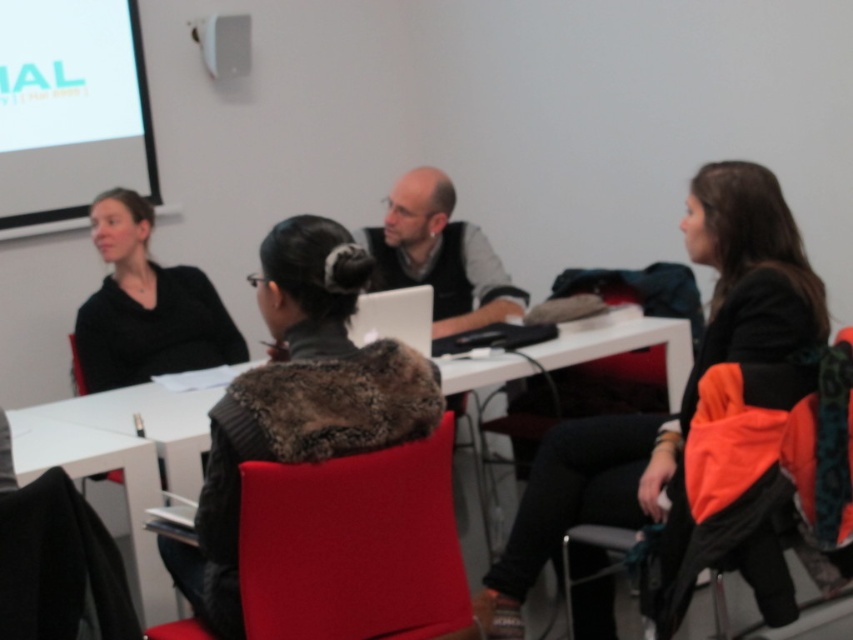
You are sitting in the black fabric chair at lower left and want to hand a document to the person sitting in the velvet red chair at center. Which direction should you move to reach them?

The velvet red chair at center is located above the black fabric chair at lower left, so you should move upwards to reach them.

You are a delivery robot with a package that measures 1.5 meters in length. You need to navigate through the space between the dark gray fur coat at center and the black matte jacket at left to reach the table. Can you fit through this space?

The distance between the dark gray fur coat at center and the black matte jacket at left is 1.36 meters. Since your package is 1.5 meters long, it is longer than the available space, so you cannot fit through this path.

You are an interior designer assessing the meeting room layout. The white matte projection screen at upper left and the black matte jacket at left are both in view. Which object occupies more visual space in the room?

The white matte projection screen at upper left is larger in size than the black matte jacket at left, so it occupies more visual space in the room.